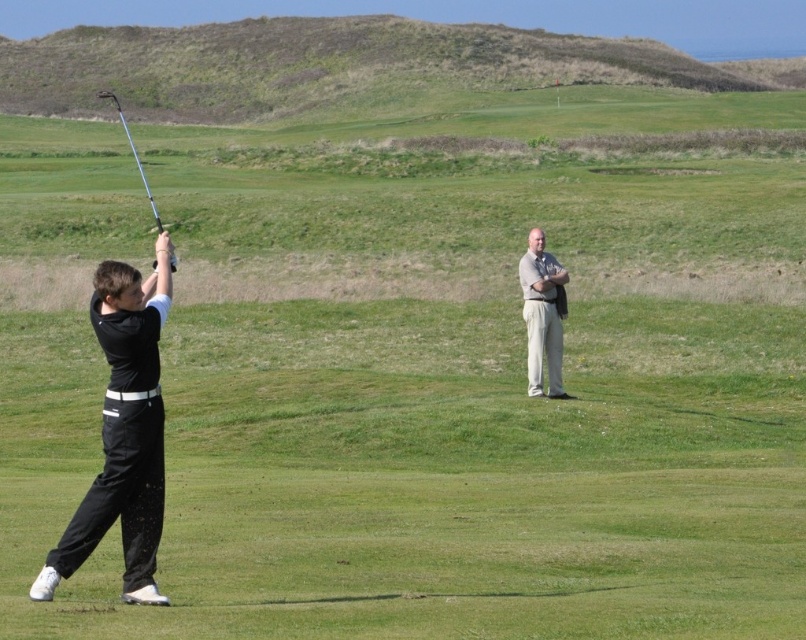
You are a golfer standing at the point marked as point (123, 432) in the image. You need to retrieve your black matte pants at left. Which direction should you move to reach them?

The black matte pants at left are located to the left of point (123, 432), so you should move to the left to reach them.

You are a golfer preparing to take a swing. You notice the black matte pants at left in your peripheral vision. Based on their position, can you estimate how far to the left they are located relative to your current position?

The black matte pants at left are located at point 0.675 on the horizontal axis and 0.155 on the vertical axis, so they are positioned to the left and slightly forward of your current position.

You are the golfer in the image. You want to retrieve your metallic silver golf club at left. Can you reach it without moving your light beige pants at center?

The metallic silver golf club at left is behind light beige pants at center, so you can reach it without moving the light beige pants at center because it is positioned behind them.